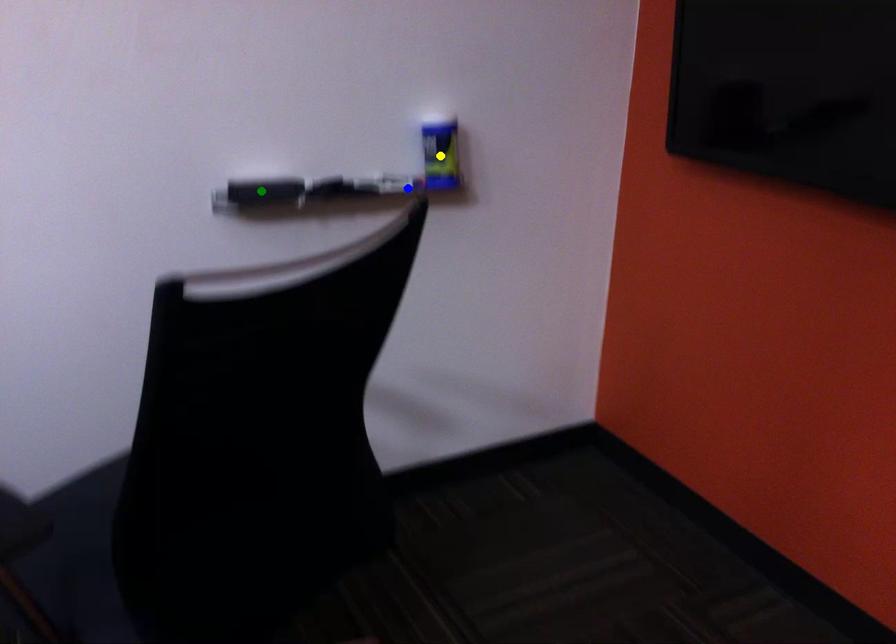
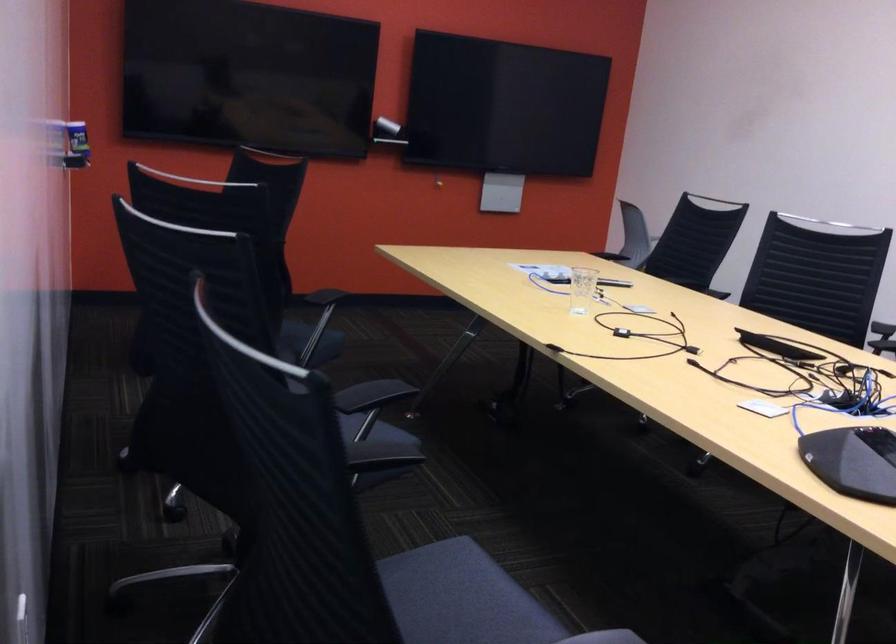
I am providing you with two images of the same scene from different viewpoints. Three points are marked in image1. Which point corresponds to a part or object that is occluded in image2?In image1, three points are marked. Which of them correspond to a part or object that is occluded in image2?Among the three points shown in image1, which one corresponds to a part or object that is no longer visible due to occlusion in image2?

yellow point, green point